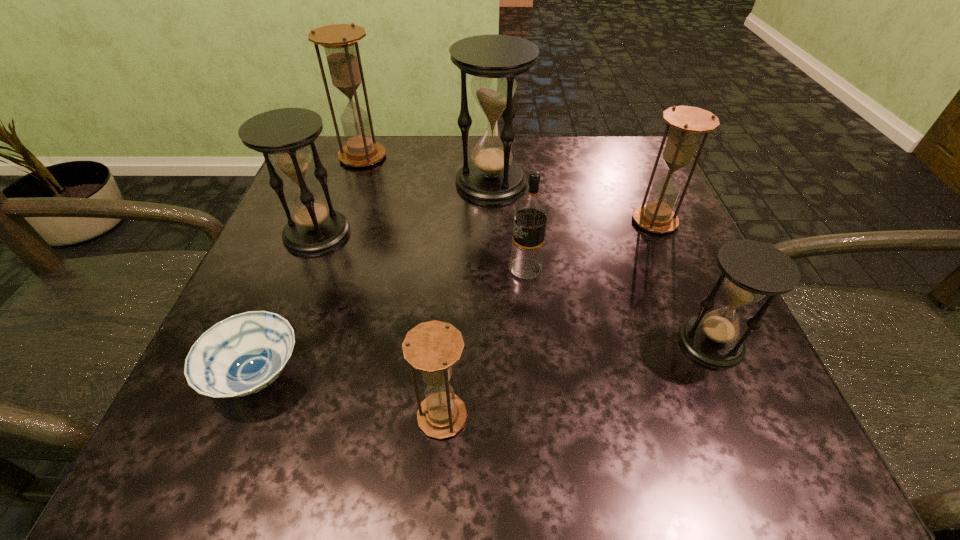
Locate an element on the screen. Image resolution: width=960 pixels, height=540 pixels. vacant space at the far edge is located at coordinates (471, 146).

Find the location of a particular element. The image size is (960, 540). free space at the near edge of the desktop is located at coordinates (549, 427).

Locate an element on the screen. vacant area at the left edge of the desktop is located at coordinates (348, 247).

Find the location of `vacant space at the right edge of the desktop`. vacant space at the right edge of the desktop is located at coordinates [653, 275].

I want to click on free space at the near left corner of the desktop, so click(247, 410).

Find the location of a particular element. The height and width of the screenshot is (540, 960). blank area at the far right corner is located at coordinates (651, 165).

Locate an element on the screen. This screenshot has height=540, width=960. free space between the leftmost black hourglass and the nearest black hourglass is located at coordinates (514, 288).

Locate an element on the screen. empty space between the rightmost black hourglass and the second nearest brown hourglass is located at coordinates (683, 282).

In order to click on vacant area that lies between the second brown hourglass from left to right and the blue soup bowl in this screenshot , I will do pyautogui.click(x=349, y=396).

Where is `vacant area that lies between the blue soup bowl and the farthest brown hourglass`? This screenshot has width=960, height=540. vacant area that lies between the blue soup bowl and the farthest brown hourglass is located at coordinates (310, 266).